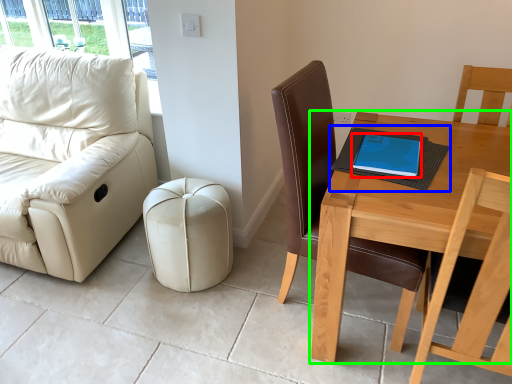
Question: Which is farther away from tablet computer (highlighted by a red box)? notebook (highlighted by a blue box) or table (highlighted by a green box)?

Choices:
 (A) notebook
 (B) table

Answer: (B)